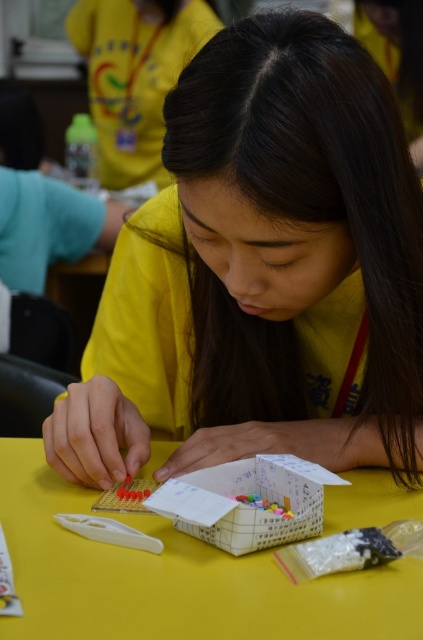
Consider the image. You are standing in front of the table and want to place a tool on the matte yellow shirt at center. Can you directly put the tool on the shirt without touching the yellow matte table at center?

The matte yellow shirt at center is further to the viewer than the yellow matte table at center, so you can directly place the tool on the shirt without it touching the table.

You are standing 24 inches away from the table in the workshop scene. You want to reach the matte yellow shirt at center to hand the person a tool. Is the shirt within your reach?

The matte yellow shirt at center is 22.49 inches away from the viewer, so yes, it is within reach since you are standing 24 inches away from the table.